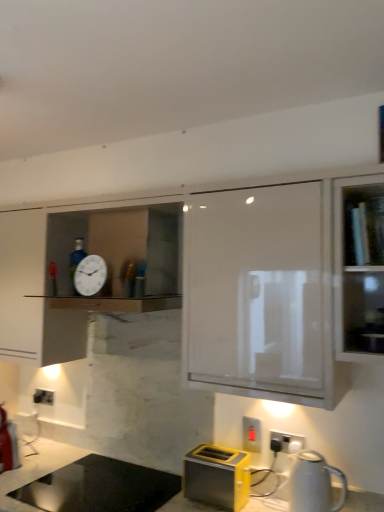
Question: Should I look upward or downward to see yellow plastic electric outlet at lower right, positioned as the second electric outlet in back-to-front order?

Choices:
 (A) up
 (B) down

Answer: (B)

Question: Does yellow metallic toaster at lower center have a lesser width compared to marble countertop at lower center?

Choices:
 (A) yes
 (B) no

Answer: (A)

Question: From the image's perspective, is yellow metallic toaster at lower center beneath marble countertop at lower center?

Choices:
 (A) yes
 (B) no

Answer: (B)

Question: Considering the relative positions of yellow metallic toaster at lower center and marble countertop at lower center in the image provided, is yellow metallic toaster at lower center to the right of marble countertop at lower center from the viewer's perspective?

Choices:
 (A) yes
 (B) no

Answer: (A)

Question: Does yellow metallic toaster at lower center have a greater width compared to marble countertop at lower center?

Choices:
 (A) yes
 (B) no

Answer: (B)

Question: From the image's perspective, is yellow metallic toaster at lower center located above marble countertop at lower center?

Choices:
 (A) yes
 (B) no

Answer: (A)

Question: Is yellow metallic toaster at lower center not close to marble countertop at lower center?

Choices:
 (A) no
 (B) yes

Answer: (A)

Question: Is white glossy clock at upper center further to the viewer compared to white glossy cabinet at upper center?

Choices:
 (A) no
 (B) yes

Answer: (B)

Question: Does white glossy clock at upper center have a larger size compared to white glossy cabinet at upper center?

Choices:
 (A) yes
 (B) no

Answer: (B)

Question: From a real-world perspective, is white glossy clock at upper center on top of white glossy cabinet at upper center?

Choices:
 (A) no
 (B) yes

Answer: (B)

Question: Can you confirm if white glossy clock at upper center is shorter than white glossy cabinet at upper center?

Choices:
 (A) no
 (B) yes

Answer: (B)

Question: Considering the relative positions of white glossy clock at upper center and white glossy cabinet at upper center in the image provided, is white glossy clock at upper center to the left of white glossy cabinet at upper center from the viewer's perspective?

Choices:
 (A) yes
 (B) no

Answer: (A)

Question: Does white glossy clock at upper center lie in front of white glossy cabinet at upper center?

Choices:
 (A) no
 (B) yes

Answer: (A)

Question: Can you confirm if clear glass shelf at upper right is thinner than marble countertop at lower center?

Choices:
 (A) no
 (B) yes

Answer: (B)